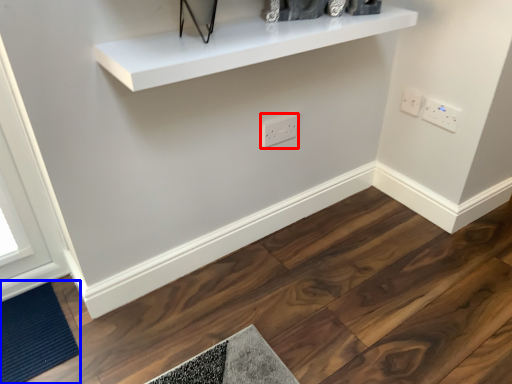
Question: Which of the following is the farthest to the observer, electric outlet (highlighted by a red box) or doormat (highlighted by a blue box)?

Choices:
 (A) electric outlet
 (B) doormat

Answer: (A)